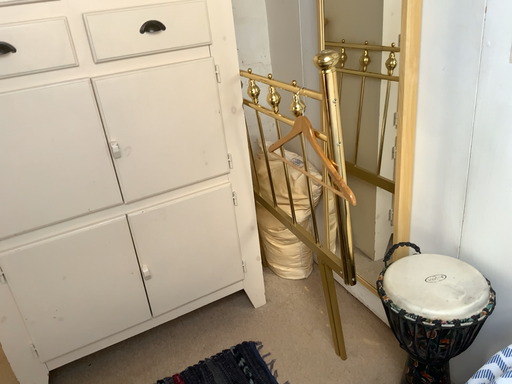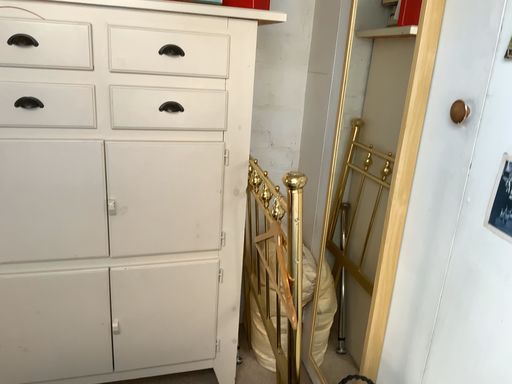
Question: Which way did the camera rotate in the video?

Choices:
 (A) rotated right
 (B) rotated left

Answer: (B)